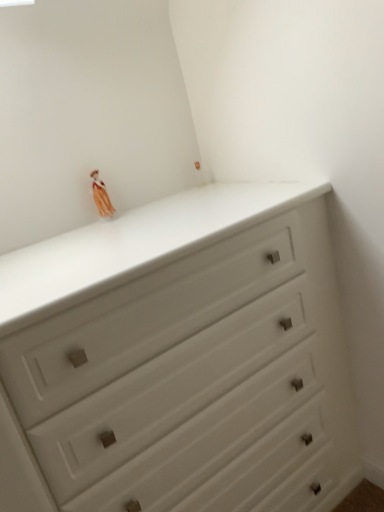
Question: Is white matte chest of drawers at upper center beside matte orange fabric doll at upper left?

Choices:
 (A) no
 (B) yes

Answer: (A)

Question: Does white matte chest of drawers at upper center appear on the right side of matte orange fabric doll at upper left?

Choices:
 (A) no
 (B) yes

Answer: (B)

Question: Considering the relative sizes of white matte chest of drawers at upper center and matte orange fabric doll at upper left in the image provided, is white matte chest of drawers at upper center shorter than matte orange fabric doll at upper left?

Choices:
 (A) no
 (B) yes

Answer: (A)

Question: From the image's perspective, is white matte chest of drawers at upper center beneath matte orange fabric doll at upper left?

Choices:
 (A) no
 (B) yes

Answer: (B)

Question: Does white matte chest of drawers at upper center have a greater width compared to matte orange fabric doll at upper left?

Choices:
 (A) yes
 (B) no

Answer: (A)

Question: Is white matte chest of drawers at upper center not near matte orange fabric doll at upper left?

Choices:
 (A) yes
 (B) no

Answer: (B)

Question: Does matte orange fabric doll at upper left appear on the right side of white matte chest of drawers at upper center?

Choices:
 (A) no
 (B) yes

Answer: (A)

Question: Does matte orange fabric doll at upper left have a lesser height compared to white matte chest of drawers at upper center?

Choices:
 (A) no
 (B) yes

Answer: (B)

Question: Would you say matte orange fabric doll at upper left is a long distance from white matte chest of drawers at upper center?

Choices:
 (A) yes
 (B) no

Answer: (B)

Question: Is matte orange fabric doll at upper left not inside white matte chest of drawers at upper center?

Choices:
 (A) yes
 (B) no

Answer: (A)

Question: Is the surface of matte orange fabric doll at upper left in direct contact with white matte chest of drawers at upper center?

Choices:
 (A) yes
 (B) no

Answer: (B)

Question: Is white matte chest of drawers at upper center completely or partially inside matte orange fabric doll at upper left?

Choices:
 (A) no
 (B) yes

Answer: (A)

Question: Which is correct: matte orange fabric doll at upper left is inside white matte chest of drawers at upper center, or outside of it?

Choices:
 (A) inside
 (B) outside

Answer: (B)